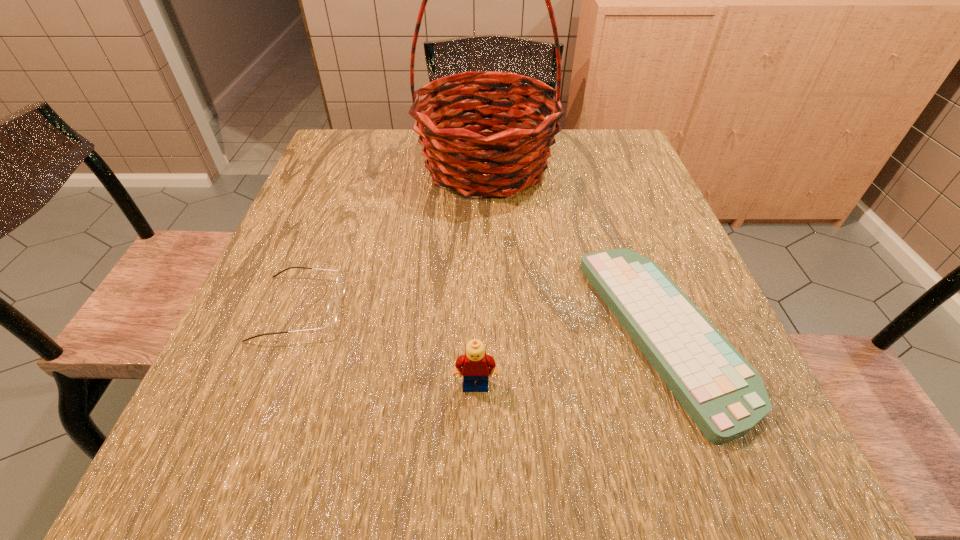
The height and width of the screenshot is (540, 960). I want to click on free space at the far left corner of the desktop, so click(353, 168).

The image size is (960, 540). Find the location of `vacant space that is in between the second shortest object and the basket`. vacant space that is in between the second shortest object and the basket is located at coordinates (394, 237).

Where is `vacant region between the third shortest object and the farthest object`? vacant region between the third shortest object and the farthest object is located at coordinates (481, 275).

At what (x,y) coordinates should I click in order to perform the action: click on empty space between the rightmost object and the second shortest object. Please return your answer as a coordinate pair (x, y). Looking at the image, I should click on (481, 321).

At what (x,y) coordinates should I click in order to perform the action: click on empty space between the third shortest object and the farthest object. Please return your answer as a coordinate pair (x, y). The width and height of the screenshot is (960, 540). Looking at the image, I should click on (481, 275).

This screenshot has height=540, width=960. I want to click on vacant point located between the second tallest object and the spectacles, so click(x=388, y=347).

I want to click on empty space between the tallest object and the leftmost object, so click(x=394, y=237).

Where is `blank region between the third tallest object and the third shortest object`? The image size is (960, 540). blank region between the third tallest object and the third shortest object is located at coordinates (388, 347).

You are a GUI agent. You are given a task and a screenshot of the screen. Output one action in this format:
    pyautogui.click(x=<x>, y=<y>)
    Task: Click on the blank region between the Lego and the computer keyboard
    Image resolution: width=960 pixels, height=540 pixels.
    Given the screenshot: What is the action you would take?
    pyautogui.click(x=569, y=360)

In order to click on vacant area that lies between the third tallest object and the computer keyboard in this screenshot , I will do `click(481, 321)`.